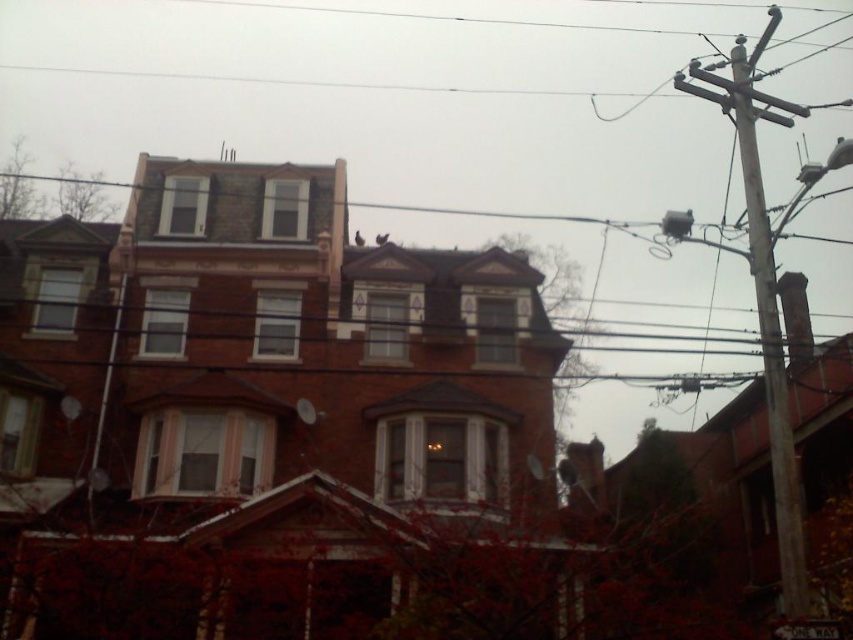
You are standing in front of the residential building and want to determine which of the two points, point (x=785, y=458) or point (x=814, y=632), is closer to you. Based on the image, which point is nearer?

Point (x=785, y=458) is closer to you because it is further to the viewer than point (x=814, y=632).

You are standing at a point 16.16 meters away from the point marked at coordinates point (750,157). Given the residential building with a brick facade and multiple windows in the scene, can you estimate how far you are from the building?

The point marked at coordinates point (750,157) is 16.16 meters away from you, so you are approximately 16.16 meters away from the building.